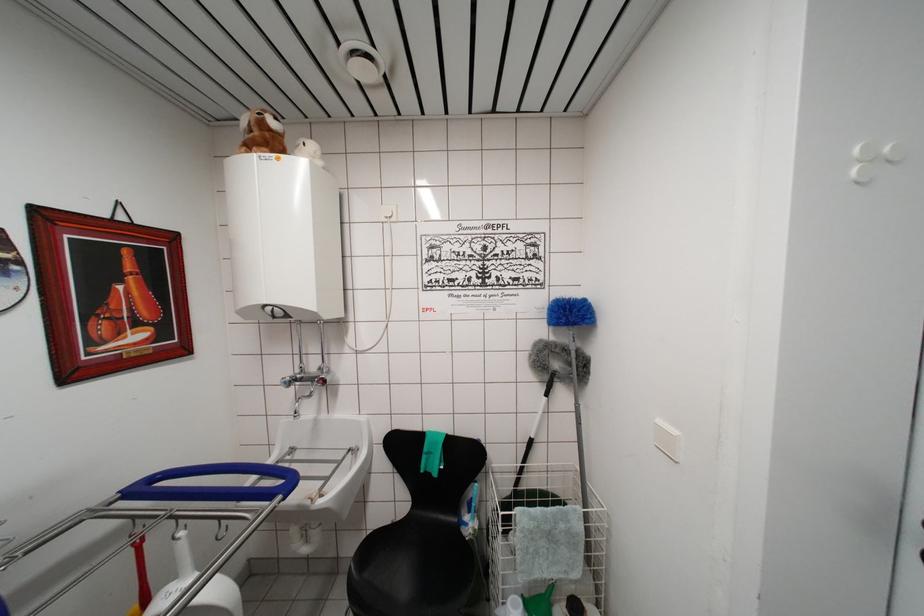
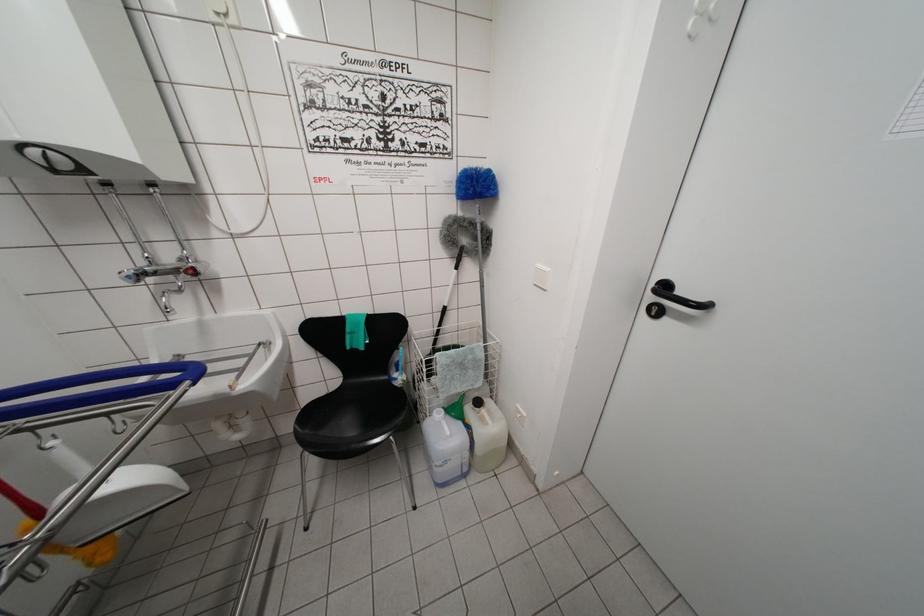
Which direction would the cameraman need to move to produce the second image?

The movement direction of the cameraman is left, backward.